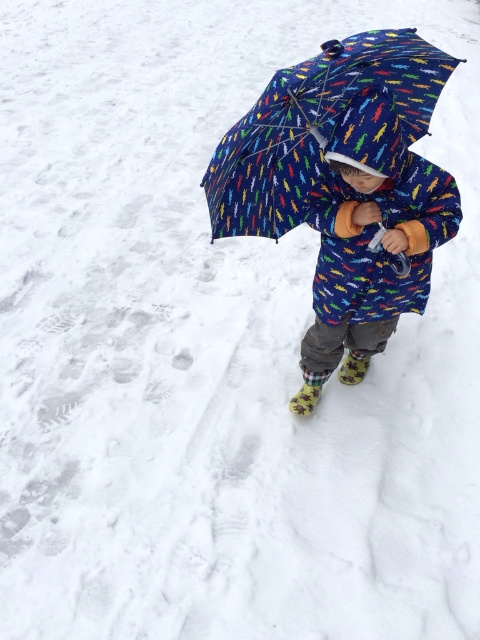
Question: Among these objects, which one is farthest from the camera?

Choices:
 (A) printed fabric umbrella at center
 (B) blue fabric umbrella at center

Answer: (B)

Question: Is printed fabric umbrella at center to the left of blue fabric umbrella at center from the viewer's perspective?

Choices:
 (A) no
 (B) yes

Answer: (A)

Question: Which point is closer to the camera taking this photo?

Choices:
 (A) (252, 168)
 (B) (338, 237)

Answer: (A)

Question: Considering the relative positions of printed fabric umbrella at center and blue fabric umbrella at center in the image provided, where is printed fabric umbrella at center located with respect to blue fabric umbrella at center?

Choices:
 (A) left
 (B) right

Answer: (B)

Question: Does printed fabric umbrella at center have a lesser width compared to blue fabric umbrella at center?

Choices:
 (A) no
 (B) yes

Answer: (B)

Question: Which object is closer to the camera taking this photo?

Choices:
 (A) blue fabric umbrella at center
 (B) printed fabric umbrella at center

Answer: (B)